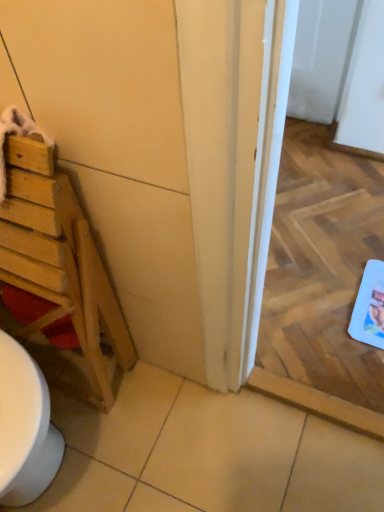
Question: Is wooden door at left far from white glossy screen door at center?

Choices:
 (A) no
 (B) yes

Answer: (A)

Question: Is wooden door at left aimed at white glossy screen door at center?

Choices:
 (A) no
 (B) yes

Answer: (A)

Question: Are wooden door at left and white glossy screen door at center making contact?

Choices:
 (A) yes
 (B) no

Answer: (B)

Question: Can we say wooden door at left lies outside white glossy screen door at center?

Choices:
 (A) yes
 (B) no

Answer: (A)

Question: From the image's perspective, would you say wooden door at left is shown under white glossy screen door at center?

Choices:
 (A) yes
 (B) no

Answer: (A)

Question: Is wooden door at left wider than white glossy screen door at center?

Choices:
 (A) yes
 (B) no

Answer: (B)

Question: Does white glossy screen door at center turn towards wooden ladder at left?

Choices:
 (A) no
 (B) yes

Answer: (A)

Question: Can you confirm if white glossy screen door at center is taller than wooden ladder at left?

Choices:
 (A) yes
 (B) no

Answer: (B)

Question: Would you say white glossy screen door at center is a long distance from wooden ladder at left?

Choices:
 (A) yes
 (B) no

Answer: (B)

Question: Does white glossy screen door at center have a lesser width compared to wooden ladder at left?

Choices:
 (A) no
 (B) yes

Answer: (A)

Question: Can you confirm if white glossy screen door at center is smaller than wooden ladder at left?

Choices:
 (A) no
 (B) yes

Answer: (B)

Question: Is white glossy screen door at center in front of wooden ladder at left?

Choices:
 (A) yes
 (B) no

Answer: (B)

Question: From a real-world perspective, is white glossy screen door at center located beneath wooden door at left?

Choices:
 (A) no
 (B) yes

Answer: (B)